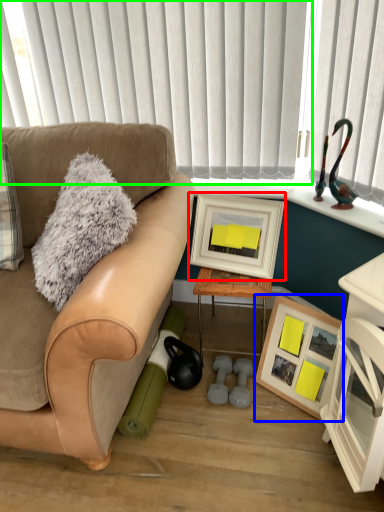
Question: Based on their relative distances, which object is nearer to picture frame (highlighted by a red box)? Choose from picture frame (highlighted by a blue box) and blind (highlighted by a green box).

Choices:
 (A) picture frame
 (B) blind

Answer: (A)